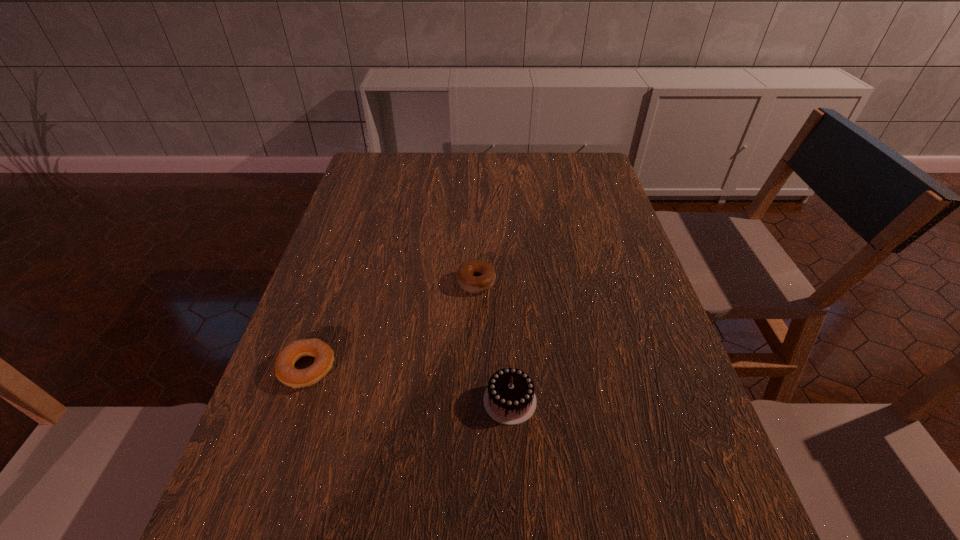
Where is `free space in the image that satisfies the following two spatial constraints: 1. on the front side of the chocolate cake; 2. on the left side of the right bagel`? free space in the image that satisfies the following two spatial constraints: 1. on the front side of the chocolate cake; 2. on the left side of the right bagel is located at coordinates (476, 401).